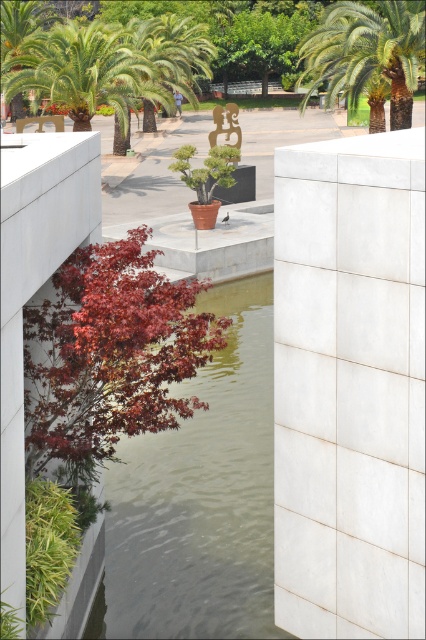
Is greenish water at center smaller than green leafy palm tree at upper left?

Indeed, greenish water at center has a smaller size compared to green leafy palm tree at upper left.

Is greenish water at center shorter than green leafy palm tree at upper left?

Indeed, greenish water at center has a lesser height compared to green leafy palm tree at upper left.

This screenshot has width=426, height=640. In order to click on greenish water at center in this screenshot , I will do `click(198, 497)`.

From the picture: Can you confirm if greenish water at center is wider than green leafy palm tree at upper center?

No, greenish water at center is not wider than green leafy palm tree at upper center.

Can you confirm if greenish water at center is positioned above green leafy palm tree at upper center?

No.

The image size is (426, 640). Find the location of `greenish water at center`. greenish water at center is located at coordinates (198, 497).

Which is in front, point (411, 547) or point (233, 545)?

Point (411, 547)

Is point (293, 202) positioned in front of point (135, 486)?

That is True.

Locate an element on the screen. The width and height of the screenshot is (426, 640). white concrete pillar at center is located at coordinates (350, 387).